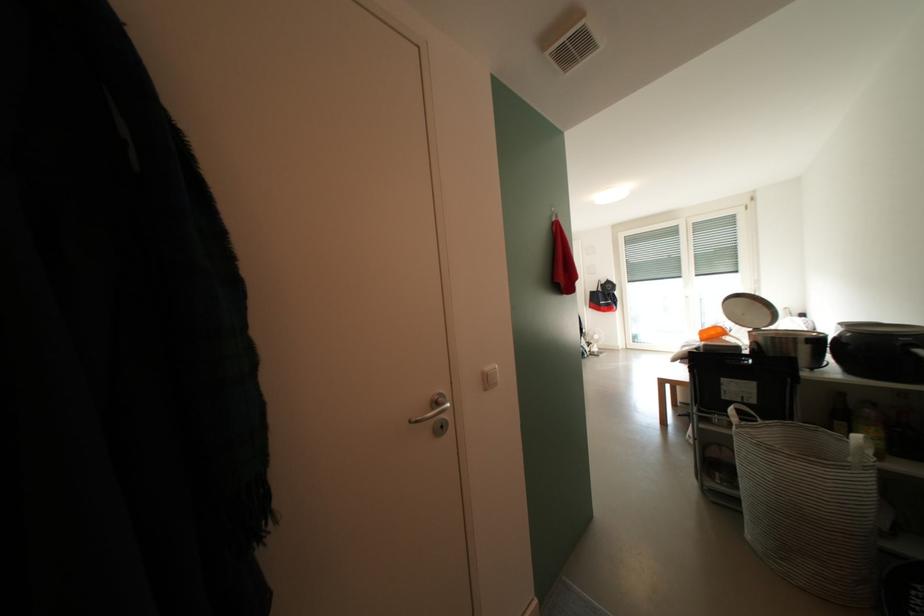
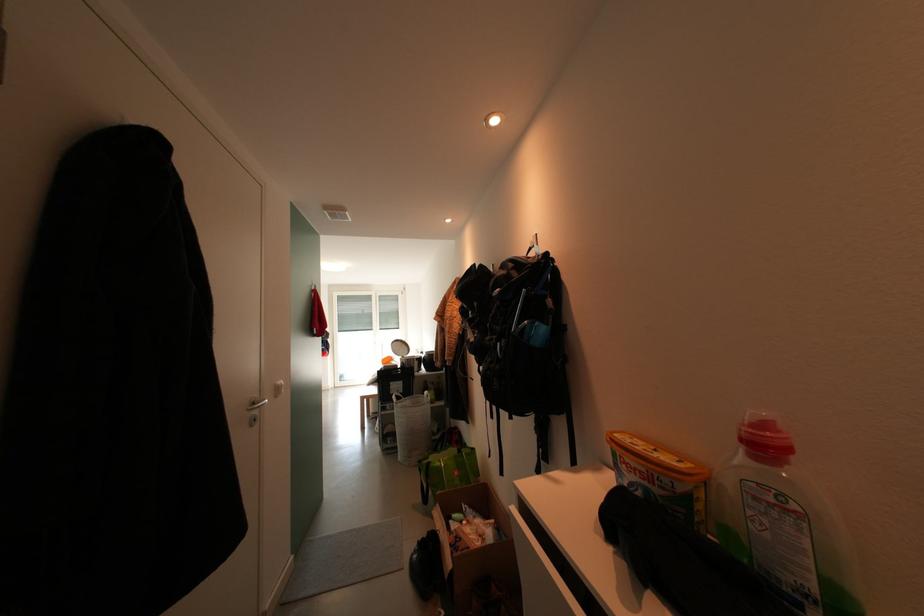
Find the pixel in the second image that matches (779,435) in the first image.

(415, 405)